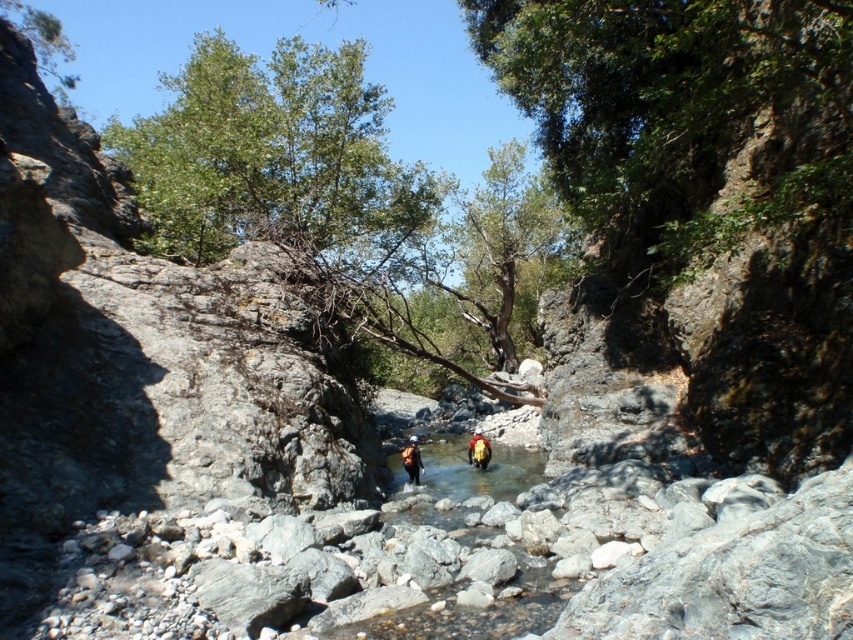
You are a hiker who wants to cross the stream safely. You have a yellow life jacket at center and a yellow fabric backpack at center. Which item should you wear or carry to stay afloat in the water?

The yellow life jacket at center is designed to keep you afloat, so you should wear it instead of the yellow fabric backpack at center.

You are a hiker who wants to take a photo of the yellow fabric backpack at center while standing near the green leafy tree at upper center. Since you want the backpack to look larger in the photo, which direction should you move relative to the tree?

To make the yellow fabric backpack at center appear larger in the photo, you should move closer to it while staying near the green leafy tree at upper center. Since the green leafy tree at upper center is taller than the backpack, moving closer will magnify the backpack in the frame without the tree blocking it.